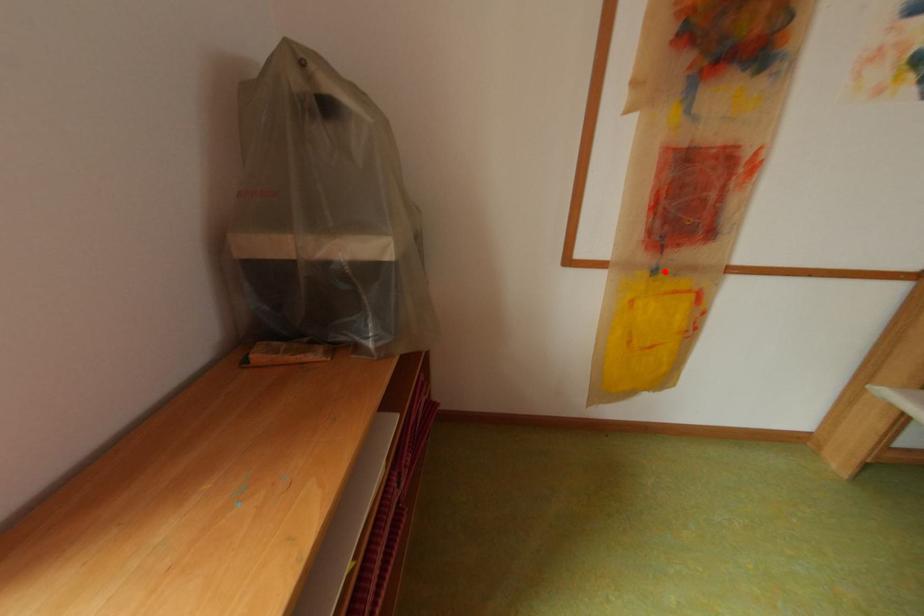
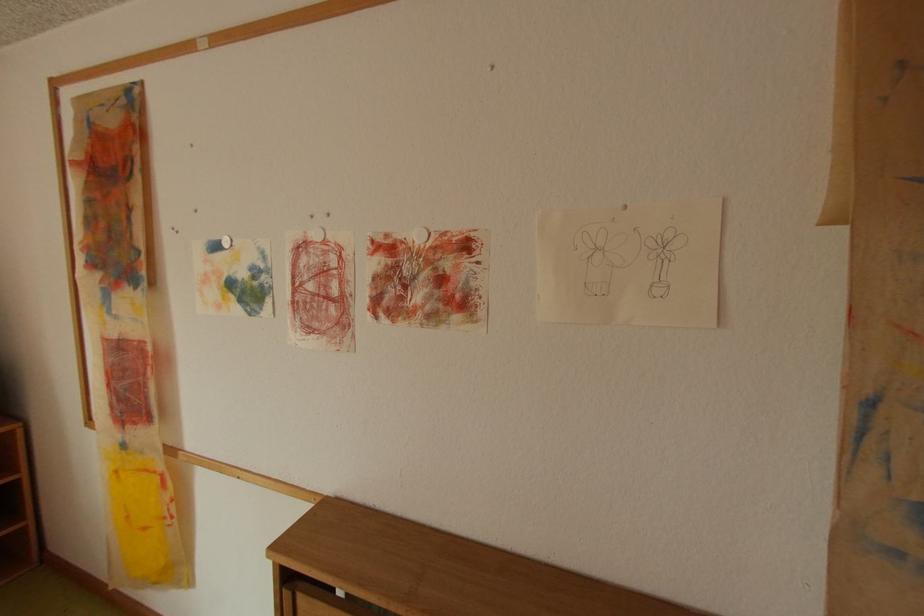
The point at the highlighted location is marked in the first image. Where is the corresponding point in the second image?

(134, 446)